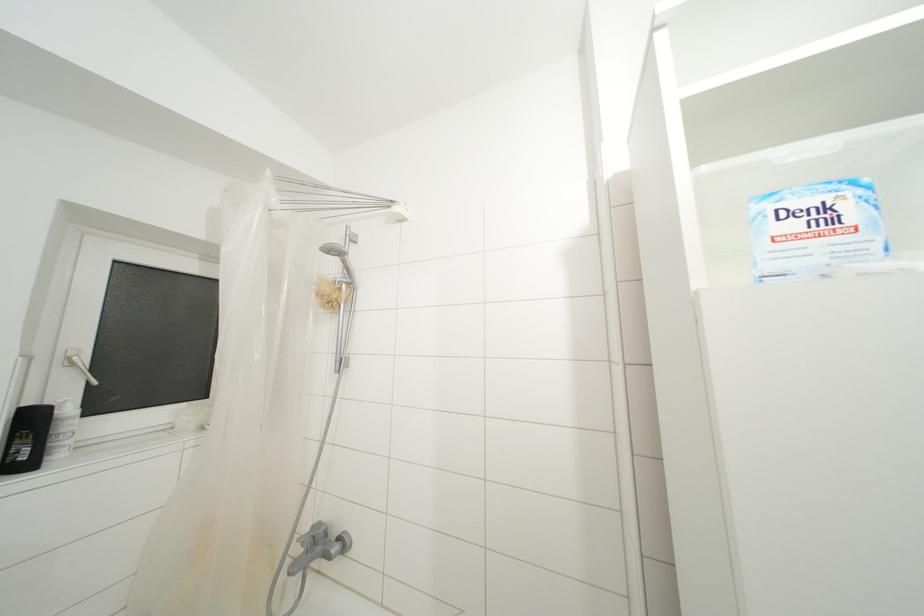
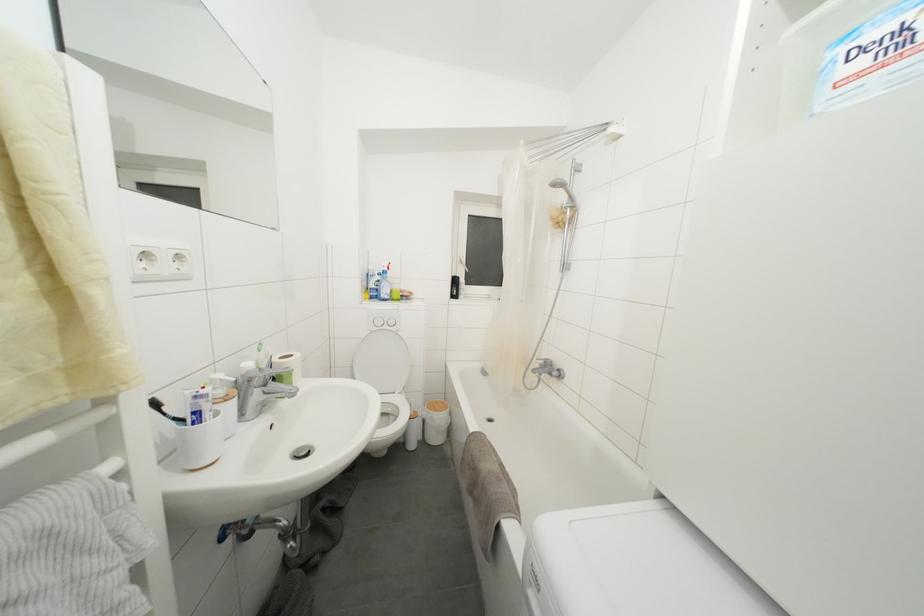
Question: The camera is either moving clockwise (left) or counter-clockwise (right) around the object. The first image is from the beginning of the video and the second image is from the end. Is the camera moving left or right when shooting the video?

Choices:
 (A) Left
 (B) Right

Answer: (B)